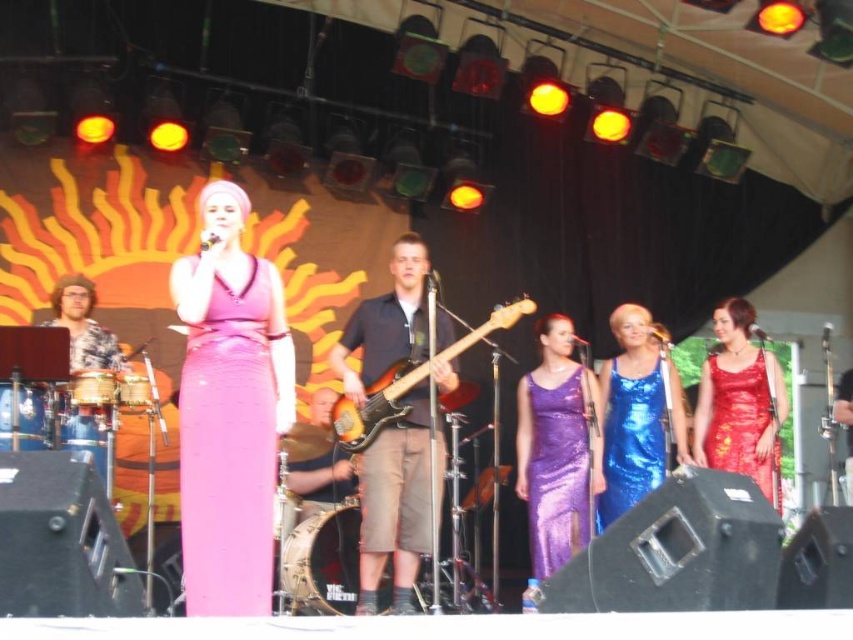
Question: Can you confirm if shiny blue dress at center is bigger than shiny red dress at center?

Choices:
 (A) yes
 (B) no

Answer: (B)

Question: Is pink satin dress at center positioned before shiny blue dress at center?

Choices:
 (A) yes
 (B) no

Answer: (A)

Question: Which of the following is the closest to the observer?

Choices:
 (A) brown wood guitar at center
 (B) shiny blue dress at center
 (C) brown leather drum at center
 (D) dark blue fabric shirt at center

Answer: (D)

Question: Which point appears closest to the camera in this image?

Choices:
 (A) 199,371
 (B) 427,326

Answer: (A)

Question: Does shiny blue dress at center appear over shiny red dress at center?

Choices:
 (A) yes
 (B) no

Answer: (B)

Question: Which point is closer to the camera taking this photo?

Choices:
 (A) (x=223, y=480)
 (B) (x=335, y=445)
 (C) (x=759, y=358)

Answer: (A)